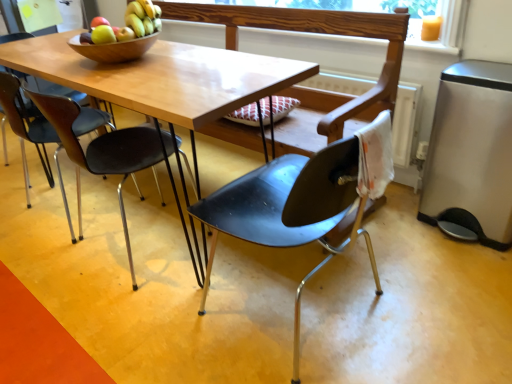
You are a GUI agent. You are given a task and a screenshot of the screen. Output one action in this format:
    pyautogui.click(x=<x>, y=<y>)
    Task: Click on the free point below matte black chair at center, acting as the 1th chair starting from the right (from a real-world perspective)
    This screenshot has width=512, height=384.
    Given the screenshot: What is the action you would take?
    pyautogui.click(x=301, y=308)